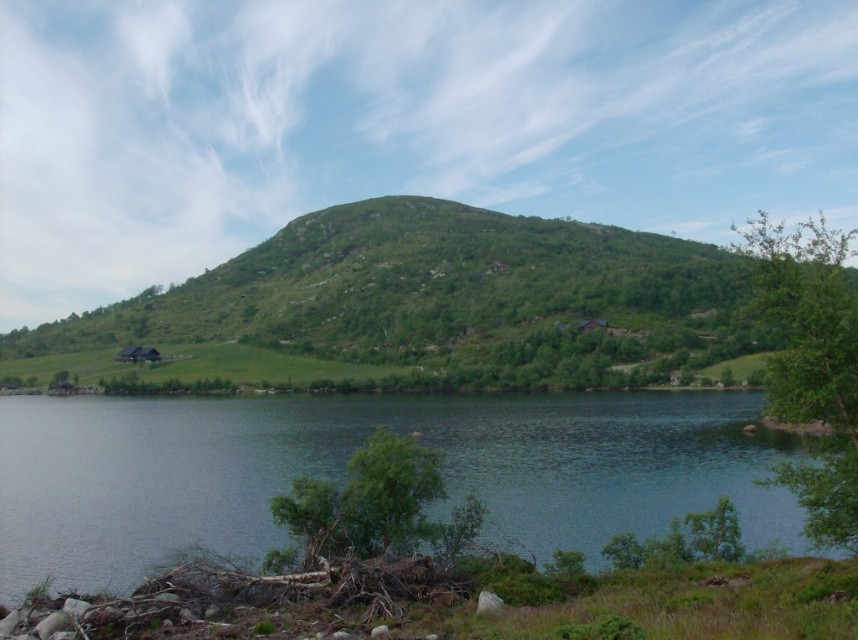
Question: Does green grassy hillside at center appear on the left side of green leafy tree at right?

Choices:
 (A) yes
 (B) no

Answer: (A)

Question: Can you confirm if greenish-blue water at lower center is positioned to the right of green leafy tree at right?

Choices:
 (A) no
 (B) yes

Answer: (A)

Question: From the image, what is the correct spatial relationship of green grassy hillside at center in relation to green leafy tree at right?

Choices:
 (A) above
 (B) below

Answer: (A)

Question: Which point is farther to the camera?

Choices:
 (A) green leafy tree at lower center
 (B) greenish-blue water at lower center
 (C) green grassy hillside at center
 (D) green leafy tree at right

Answer: (B)

Question: Based on their relative distances, which object is nearer to the greenish-blue water at lower center?

Choices:
 (A) green grassy hillside at center
 (B) green leafy tree at right
 (C) green leafy tree at lower center

Answer: (C)

Question: Which point is closer to the camera?

Choices:
 (A) greenish-blue water at lower center
 (B) green grassy hillside at center

Answer: (B)